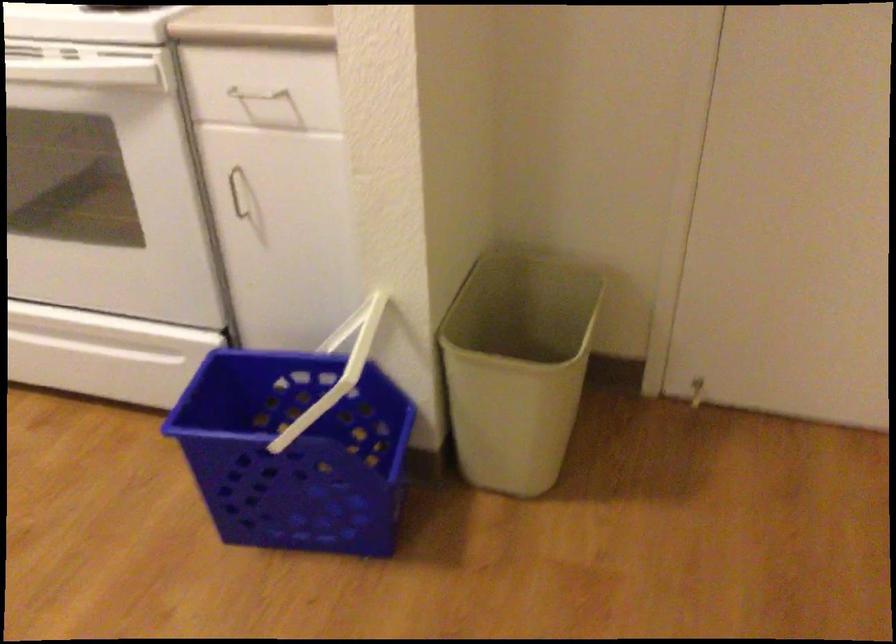
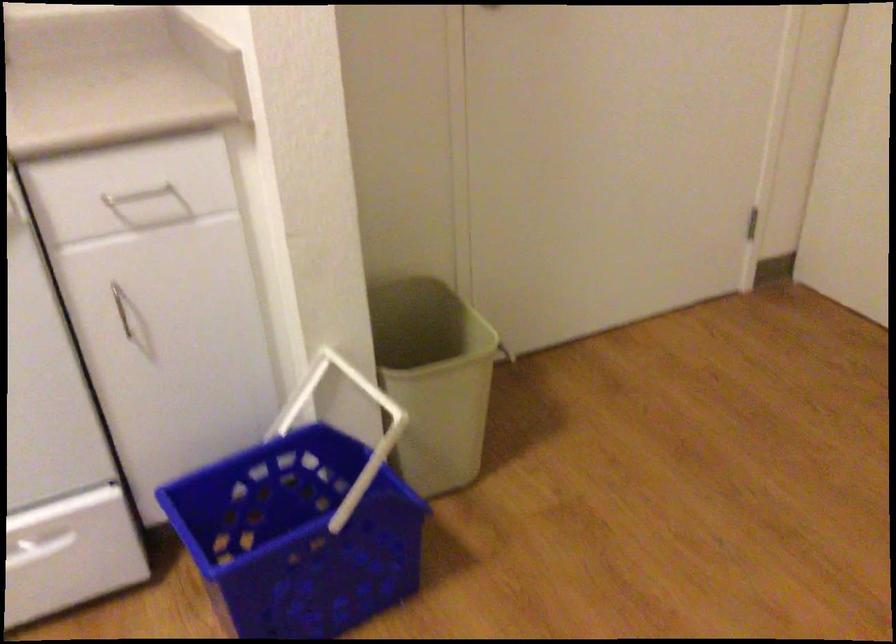
Find the pixel in the second image that matches (392,353) in the first image.

(343, 402)